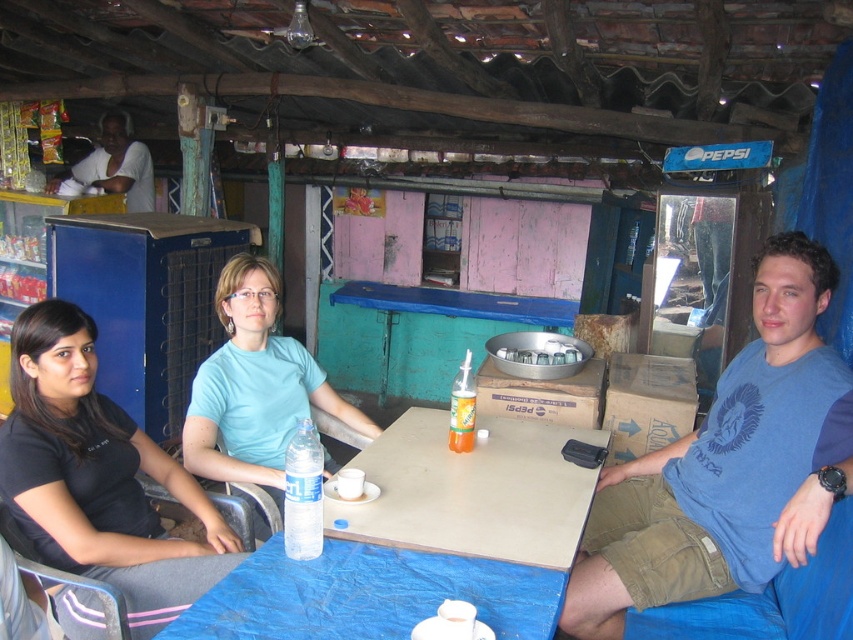
You are a customer at the rustic cafe and want to choose the larger bottle of drink. Which one should you pick between the clear plastic bottle at center and the clear plastic bottle at table center?

Answer: The clear plastic bottle at table center is larger in size compared to the clear plastic bottle at center, so you should pick the clear plastic bottle at table center.

You are a customer in the cafe and want to place your phone on the table. Considering the white plastic table at center and the white matte shirt at upper left, which one has a larger surface area to place your phone?

The white plastic table at center has a larger surface area than the white matte shirt at upper left because its width surpasses the shirt.

You are a customer at the rustic cafe and want to place your phone on the table. The phone is 15 cm long. Is there enough space between the clear plastic bottle at center and the edge of the table to place your phone horizontally?

The clear plastic bottle at center is located at point (303,493). Without specific information about the table size or the distance from the bottle to the edge, it is impossible to determine if there is enough space for the phone. Please check the table dimensions or the available space visually.